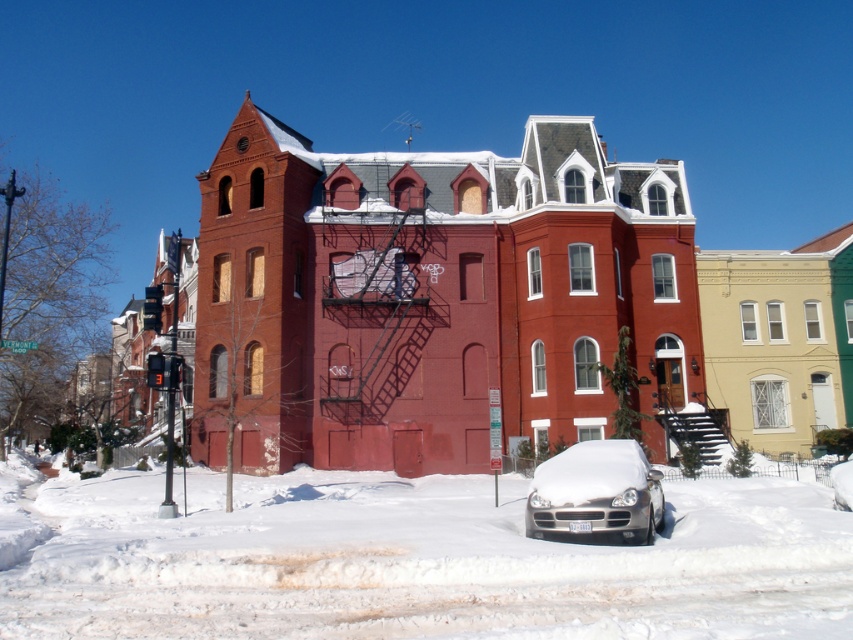
You are a delivery person trying to deliver a package to the red brick building with a steeply pitched roof. You see the white fluffy snow at center and the silver metallic car at lower center in your path. Which object is bigger and might block your way?

The white fluffy snow at center is larger in size compared to the silver metallic car at lower center, so it might block your way.

You are a delivery person trying to deliver a package to the red brick building with a steeply pitched roof. You see the white fluffy snow at center and the silver metallic car at lower center in your path. Can you drive your delivery van through the area between them?

The white fluffy snow at center is much taller than the silver metallic car at lower center. Since the snow is taller, it likely blocks the path, making it impossible for the delivery van to pass through the area between them.